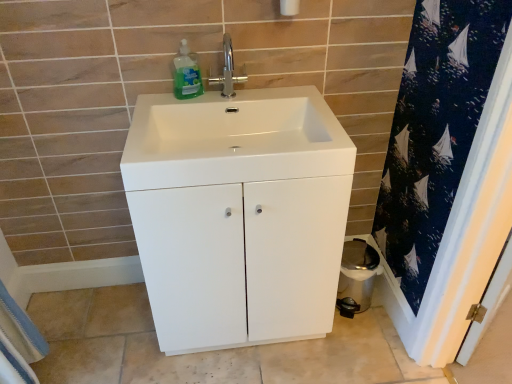
Question: Is white glossy cabinet at center aimed at white cotton bath towel at lower left?

Choices:
 (A) yes
 (B) no

Answer: (B)

Question: From the image's perspective, does white glossy cabinet at center appear lower than white cotton bath towel at lower left?

Choices:
 (A) yes
 (B) no

Answer: (B)

Question: Is white glossy cabinet at center bigger than white cotton bath towel at lower left?

Choices:
 (A) no
 (B) yes

Answer: (B)

Question: Considering the relative sizes of white glossy cabinet at center and white cotton bath towel at lower left in the image provided, is white glossy cabinet at center smaller than white cotton bath towel at lower left?

Choices:
 (A) yes
 (B) no

Answer: (B)

Question: Does white glossy cabinet at center lie behind white cotton bath towel at lower left?

Choices:
 (A) no
 (B) yes

Answer: (A)

Question: Is white glossy toilet bowl at lower right wider or thinner than polished chrome faucet at center?

Choices:
 (A) wide
 (B) thin

Answer: (A)

Question: Considering their positions, is white glossy toilet bowl at lower right located in front of or behind polished chrome faucet at center?

Choices:
 (A) front
 (B) behind

Answer: (B)

Question: Choose the correct answer: Is white glossy toilet bowl at lower right inside polished chrome faucet at center or outside it?

Choices:
 (A) outside
 (B) inside

Answer: (A)

Question: In the image, is white glossy toilet bowl at lower right on the left side or the right side of polished chrome faucet at center?

Choices:
 (A) right
 (B) left

Answer: (A)

Question: From a real-world perspective, is white glossy toilet bowl at lower right above or below white glossy cabinet at center?

Choices:
 (A) below
 (B) above

Answer: (A)

Question: Considering the positions of white glossy toilet bowl at lower right and white glossy cabinet at center in the image, is white glossy toilet bowl at lower right taller or shorter than white glossy cabinet at center?

Choices:
 (A) short
 (B) tall

Answer: (A)

Question: In the image, is white glossy toilet bowl at lower right positioned in front of or behind white glossy cabinet at center?

Choices:
 (A) behind
 (B) front

Answer: (A)

Question: From the image's perspective, is white glossy toilet bowl at lower right above or below white glossy cabinet at center?

Choices:
 (A) above
 (B) below

Answer: (B)

Question: Relative to white glossy sink at center, is polished chrome faucet at center in front or behind?

Choices:
 (A) front
 (B) behind

Answer: (B)

Question: Looking at their shapes, would you say polished chrome faucet at center is wider or thinner than white glossy sink at center?

Choices:
 (A) wide
 (B) thin

Answer: (B)